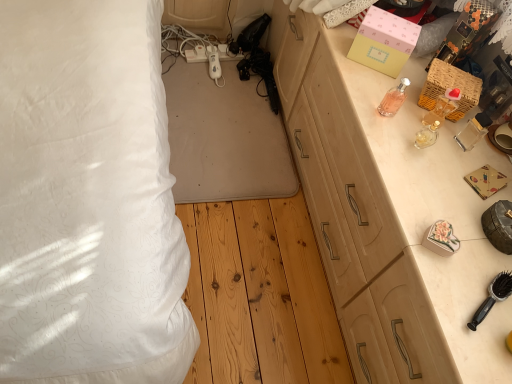
You are a GUI agent. You are given a task and a screenshot of the screen. Output one action in this format:
    pyautogui.click(x=<x>, y=<y>)
    Task: Click on the free location to the left of clear glass perfume at upper right, marked as the 3th perfume in a left-to-right arrangement
    
    Given the screenshot: What is the action you would take?
    380,102